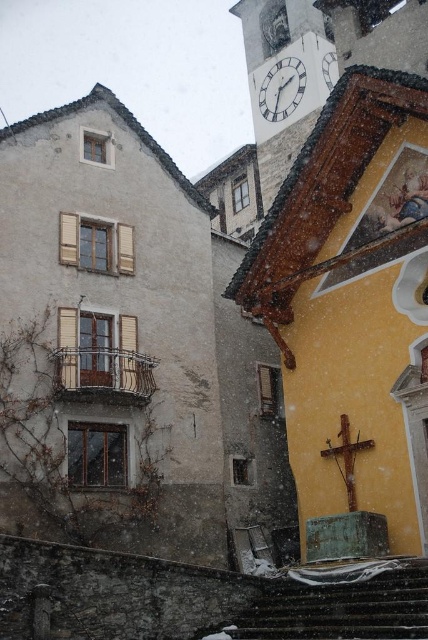
Does snow-covered stone stairs at lower center appear under white glossy clock at upper center?

Correct, snow-covered stone stairs at lower center is located below white glossy clock at upper center.

Which is behind, point (379, 621) or point (273, 81)?

Positioned behind is point (273, 81).

What are the coordinates of `snow-covered stone stairs at lower center` in the screenshot? It's located at (339, 602).